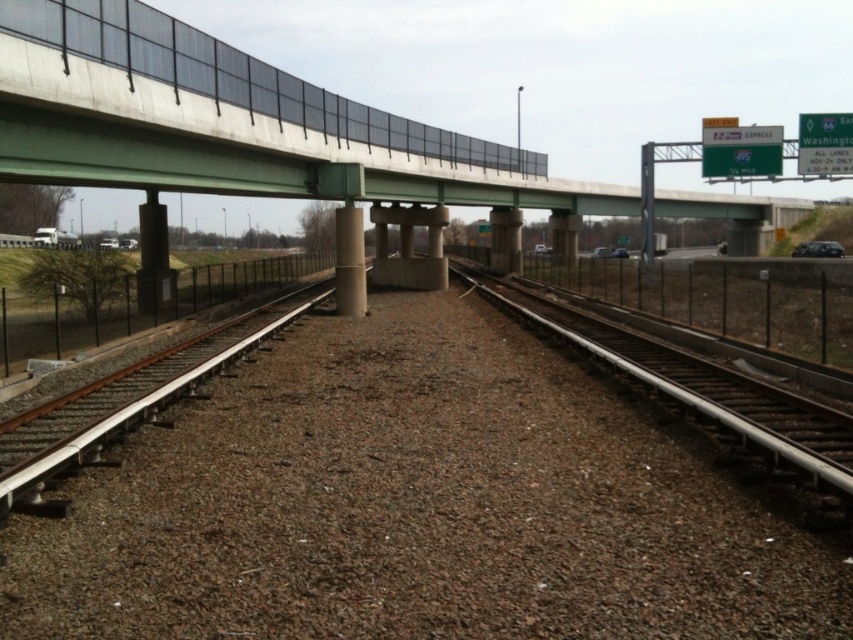
Question: Is rusty metal train track at center to the right of concrete pillar at center from the viewer's perspective?

Choices:
 (A) no
 (B) yes

Answer: (B)

Question: Which object is closer to the camera taking this photo?

Choices:
 (A) concrete pillar at center
 (B) rusty metal train track at center

Answer: (B)

Question: Does rusty metal train track at center appear over concrete at center?

Choices:
 (A) no
 (B) yes

Answer: (A)

Question: Which point is closer to the camera taking this photo?

Choices:
 (A) (813, 445)
 (B) (148, 198)

Answer: (A)

Question: Which of these objects is positioned farthest from the rusty metal train track at center?

Choices:
 (A) concrete at center
 (B) concrete pillar at center

Answer: (B)

Question: Is rusty metal train track at center further to the viewer compared to concrete at center?

Choices:
 (A) yes
 (B) no

Answer: (B)